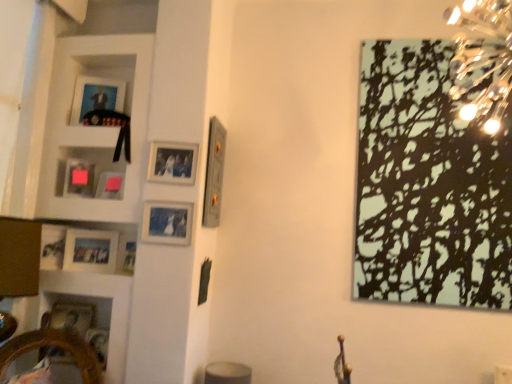
Question: Does wooden photo frame at lower left, which is counted as the first picture frame, starting from the left, lie behind matte plastic picture frame at upper left, the sixth picture frame from the right?

Choices:
 (A) yes
 (B) no

Answer: (B)

Question: From the image's perspective, is wooden photo frame at lower left, which is counted as the first picture frame, starting from the left, located beneath matte plastic picture frame at upper left, the sixth picture frame from the right?

Choices:
 (A) yes
 (B) no

Answer: (A)

Question: Is there a large distance between wooden photo frame at lower left, which is counted as the first picture frame, starting from the left, and matte plastic picture frame at upper left, the sixth picture frame from the right?

Choices:
 (A) no
 (B) yes

Answer: (A)

Question: Could you tell me if wooden photo frame at lower left, which is counted as the first picture frame, starting from the left, is turned towards matte plastic picture frame at upper left, the 5th picture frame viewed from the left?

Choices:
 (A) no
 (B) yes

Answer: (A)

Question: From a real-world perspective, is wooden photo frame at lower left, which is counted as the first picture frame, starting from the left, positioned over matte plastic picture frame at upper left, the 5th picture frame viewed from the left, based on gravity?

Choices:
 (A) yes
 (B) no

Answer: (B)

Question: Is wooden photo frame at lower left, the 10th picture frame in the right-to-left sequence, surrounding matte plastic picture frame at upper left, the sixth picture frame from the right?

Choices:
 (A) yes
 (B) no

Answer: (B)

Question: Is wooden mirror at lower left turned away from matte silver picture frame at upper center, positioned as the third picture frame in right-to-left order?

Choices:
 (A) no
 (B) yes

Answer: (A)

Question: Is wooden mirror at lower left closer to camera compared to matte silver picture frame at upper center, the eighth picture frame positioned from the left?

Choices:
 (A) no
 (B) yes

Answer: (B)

Question: Can you confirm if wooden mirror at lower left is smaller than matte silver picture frame at upper center, positioned as the third picture frame in right-to-left order?

Choices:
 (A) yes
 (B) no

Answer: (B)

Question: Does wooden mirror at lower left have a greater width compared to matte silver picture frame at upper center, the eighth picture frame positioned from the left?

Choices:
 (A) no
 (B) yes

Answer: (B)

Question: From the image's perspective, does wooden mirror at lower left appear higher than matte silver picture frame at upper center, positioned as the third picture frame in right-to-left order?

Choices:
 (A) yes
 (B) no

Answer: (B)

Question: From a real-world perspective, is wooden mirror at lower left on top of matte silver picture frame at upper center, the eighth picture frame positioned from the left?

Choices:
 (A) no
 (B) yes

Answer: (A)

Question: Is black matte picture frame at upper right, arranged as the 10th picture frame when viewed from the left, closer to the viewer compared to matte silver picture frame at upper center, the eighth picture frame positioned from the left?

Choices:
 (A) yes
 (B) no

Answer: (A)